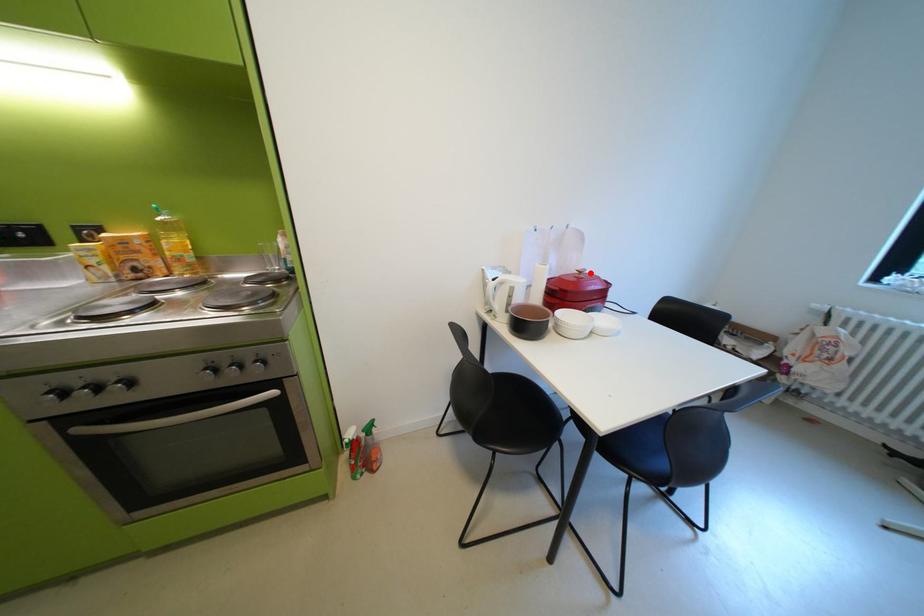
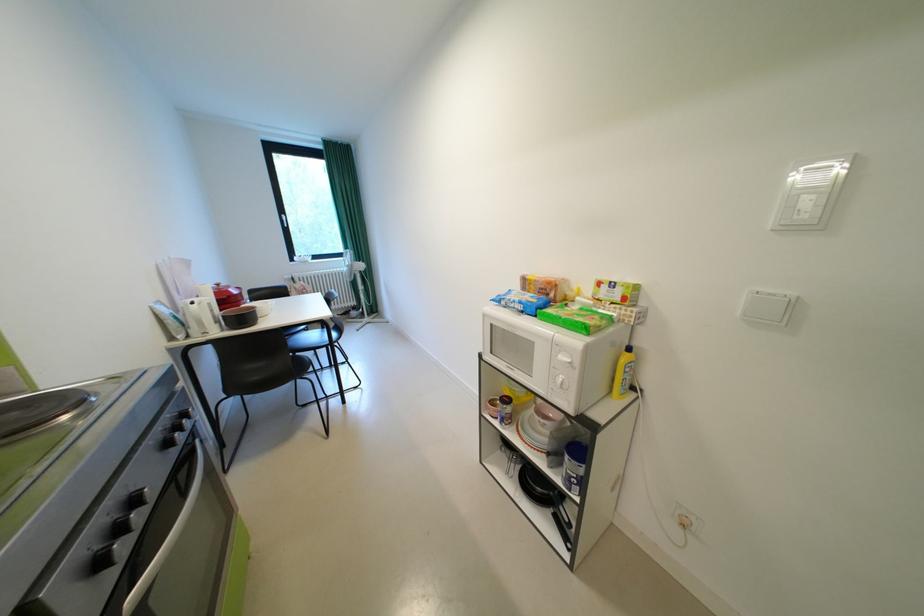
The point at the highlighted location is marked in the first image. Where is the corresponding point in the second image?

(228, 286)